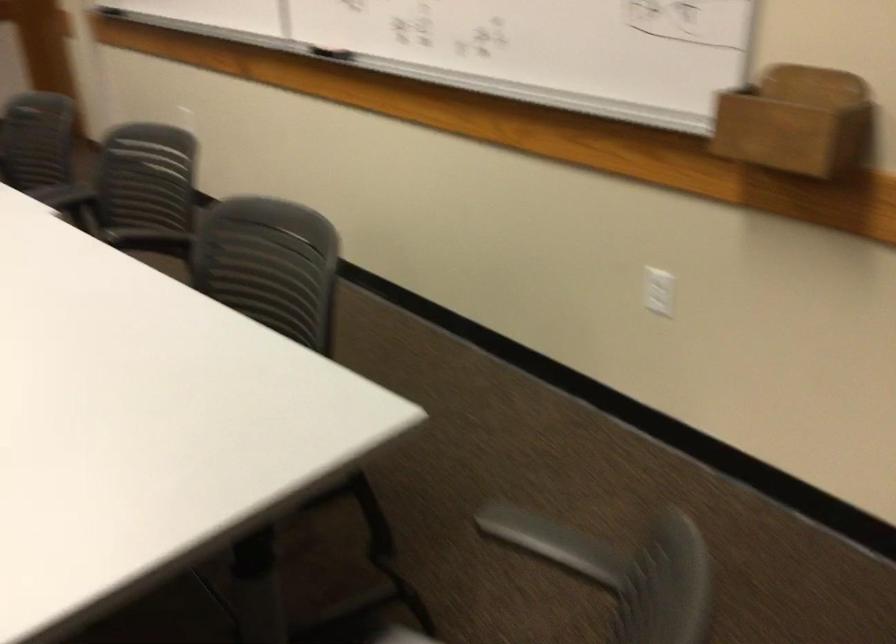
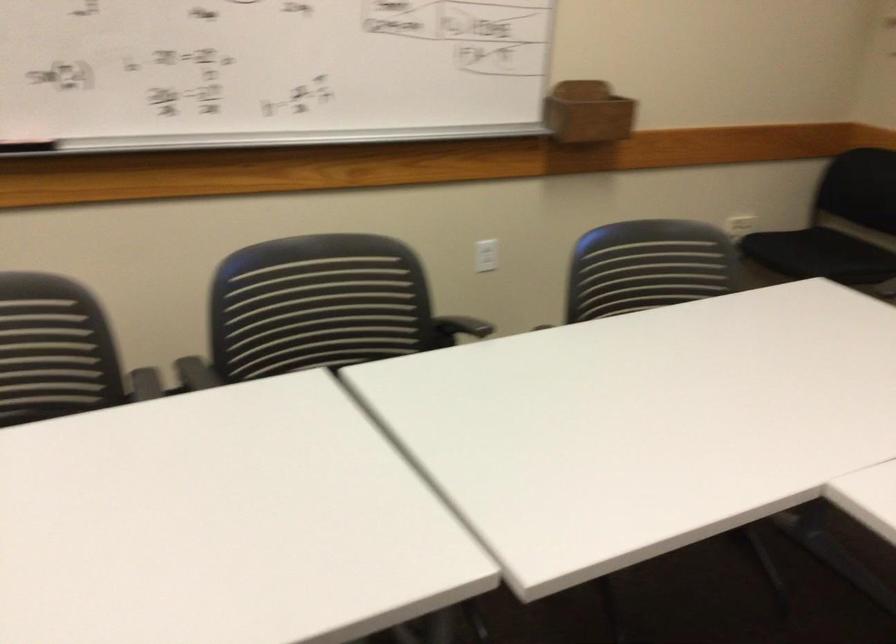
Where in the second image is the point corresponding to pixel 754 122 from the first image?

(588, 111)